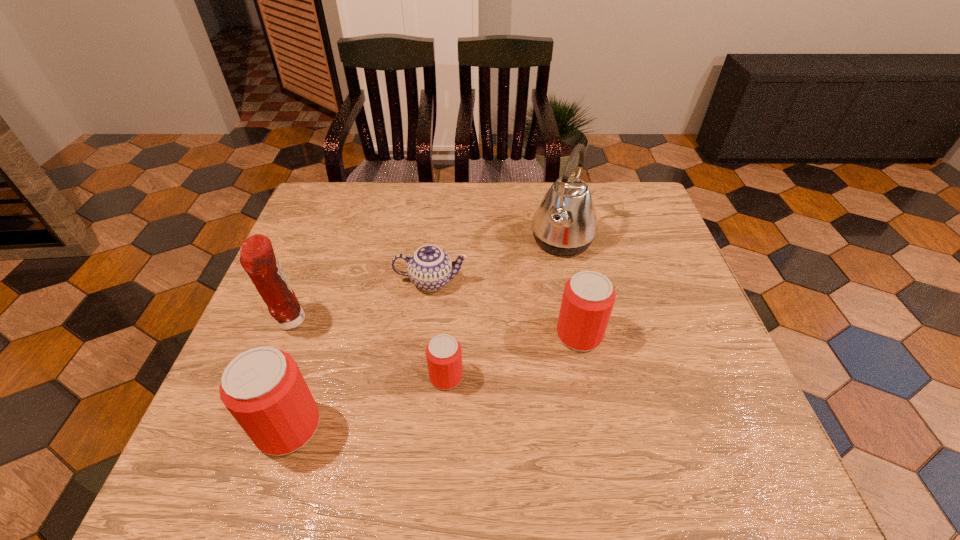
Where is `vacant space located 0.200m on the right of the nearest beer can`? The image size is (960, 540). vacant space located 0.200m on the right of the nearest beer can is located at coordinates (422, 427).

At what (x,y) coordinates should I click in order to perform the action: click on vacant space located on the left of the second beer can from left to right. Please return your answer as a coordinate pair (x, y). Looking at the image, I should click on (252, 377).

You are a GUI agent. You are given a task and a screenshot of the screen. Output one action in this format:
    pyautogui.click(x=<x>, y=<y>)
    Task: Click on the free location located on the left of the fourth tallest object
    This screenshot has height=540, width=960.
    Given the screenshot: What is the action you would take?
    pyautogui.click(x=440, y=335)

Identify the location of vacant space located 0.310m at the spout of the second farthest object. (588, 281).

Where is `free space located on the left of the kettle`? The width and height of the screenshot is (960, 540). free space located on the left of the kettle is located at coordinates (421, 240).

Find the location of a particular element. vacant region located 0.180m on the right of the fifth shortest object is located at coordinates (382, 321).

Locate an element on the screen. The width and height of the screenshot is (960, 540). object present at the far edge is located at coordinates (565, 224).

You are a GUI agent. You are given a task and a screenshot of the screen. Output one action in this format:
    pyautogui.click(x=<x>, y=<y>)
    Task: Click on the beer can at the left edge
    
    Given the screenshot: What is the action you would take?
    click(x=263, y=388)

At what (x,y) coordinates should I click in order to perform the action: click on condiment located at the left edge. Please return your answer as a coordinate pair (x, y). The height and width of the screenshot is (540, 960). Looking at the image, I should click on click(x=257, y=257).

Where is `object that is at the near left corner`? object that is at the near left corner is located at coordinates (263, 388).